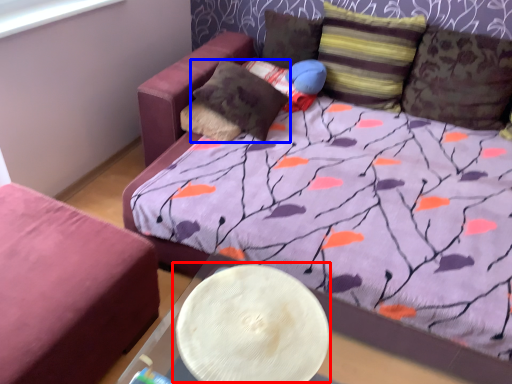
Question: Which object is further to the camera taking this photo, round table (highlighted by a red box) or pillow (highlighted by a blue box)?

Choices:
 (A) round table
 (B) pillow

Answer: (B)